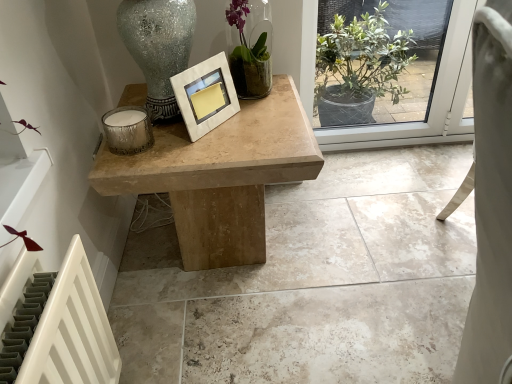
Locate an element on the screen. vacant area in front of natural wood table at center is located at coordinates (241, 335).